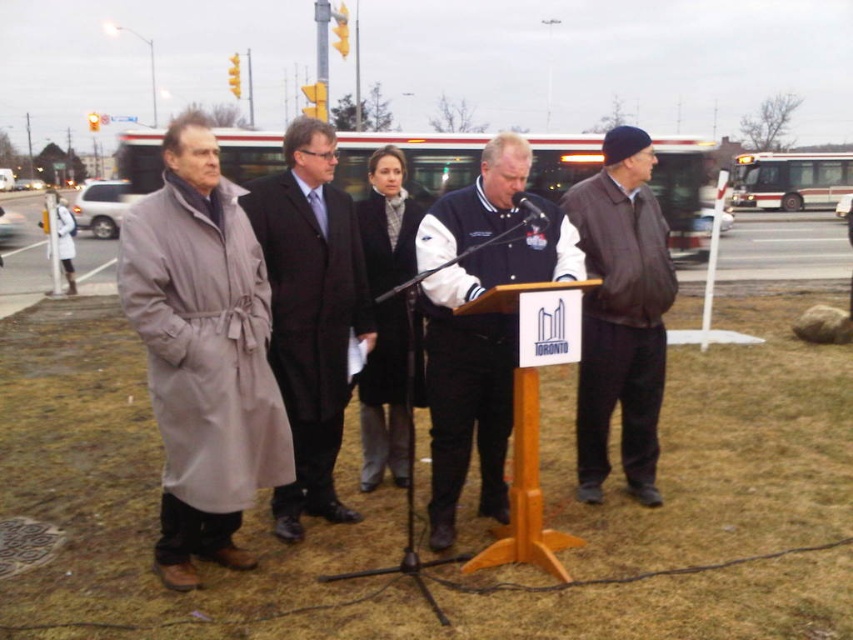
Question: Can you confirm if varsity jacket at center is positioned above black plastic microphone at center?

Choices:
 (A) no
 (B) yes

Answer: (A)

Question: Which object is closer to the camera taking this photo?

Choices:
 (A) dark brown wool coat at center
 (B) brown leather jacket at right
 (C) light beige trench coat at left
 (D) black plastic microphone at center

Answer: (C)

Question: Does light beige trench coat at left have a larger size compared to varsity jacket at center?

Choices:
 (A) yes
 (B) no

Answer: (A)

Question: Which of the following is the closest to the observer?

Choices:
 (A) (555, 352)
 (B) (428, 400)
 (C) (355, 260)
 (D) (531, 211)

Answer: (A)

Question: Which of the following is the closest to the observer?

Choices:
 (A) wooden podium at center
 (B) dark brown wool coat at center
 (C) black plastic microphone at center

Answer: (A)

Question: Where is varsity jacket at center located in relation to black plastic microphone at center in the image?

Choices:
 (A) right
 (B) left

Answer: (B)